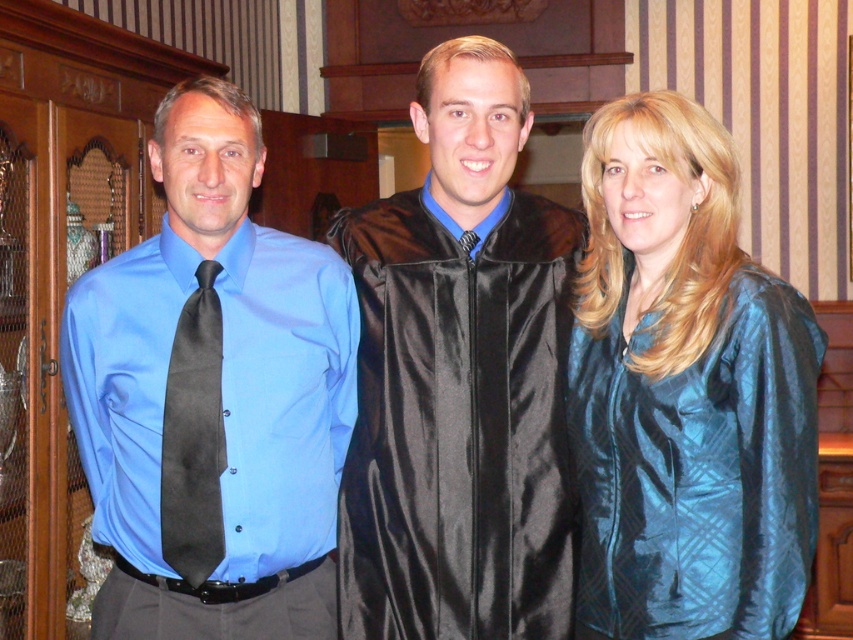
Question: Observing the image, what is the correct spatial positioning of matte blue shirt at left in reference to black satin tie at left?

Choices:
 (A) right
 (B) left

Answer: (B)

Question: Which object appears farthest from the camera in this image?

Choices:
 (A) matte blue shirt at left
 (B) black satin tie at left
 (C) teal silk blouse at center
 (D) satin black gown at center

Answer: (D)

Question: Which object is positioned closest to the matte blue shirt at left?

Choices:
 (A) black satin tie at left
 (B) satin black gown at center

Answer: (A)

Question: Which object is the closest to the teal silk blouse at center?

Choices:
 (A) matte blue shirt at left
 (B) satin black gown at center
 (C) black satin tie at left

Answer: (B)

Question: Does matte blue shirt at left have a smaller size compared to black satin tie at left?

Choices:
 (A) no
 (B) yes

Answer: (A)

Question: Is satin black gown at center to the left of teal silk blouse at center from the viewer's perspective?

Choices:
 (A) yes
 (B) no

Answer: (A)